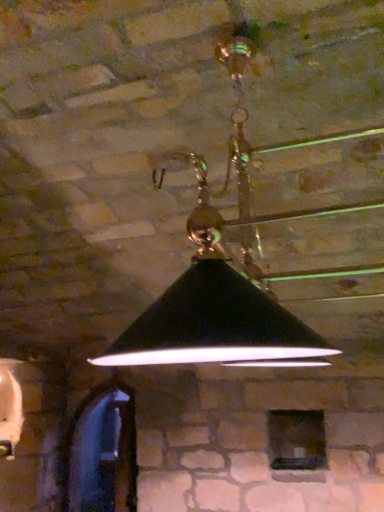
The height and width of the screenshot is (512, 384). Find the location of `black matte lampshade at center`. black matte lampshade at center is located at coordinates (218, 308).

The height and width of the screenshot is (512, 384). Describe the element at coordinates (218, 308) in the screenshot. I see `black matte lampshade at center` at that location.

Locate an element on the screen. The width and height of the screenshot is (384, 512). black matte lampshade at center is located at coordinates (218, 308).